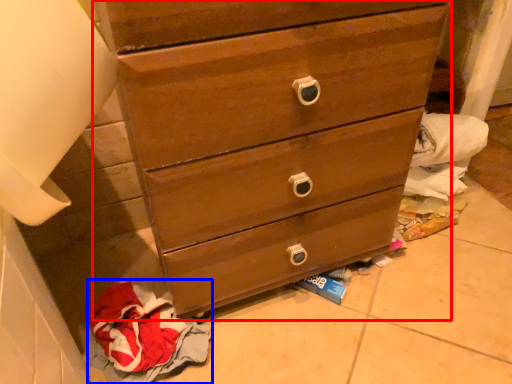
Question: Among these objects, which one is farthest to the camera, chest of drawers (highlighted by a red box) or baby clothe (highlighted by a blue box)?

Choices:
 (A) chest of drawers
 (B) baby clothe

Answer: (B)